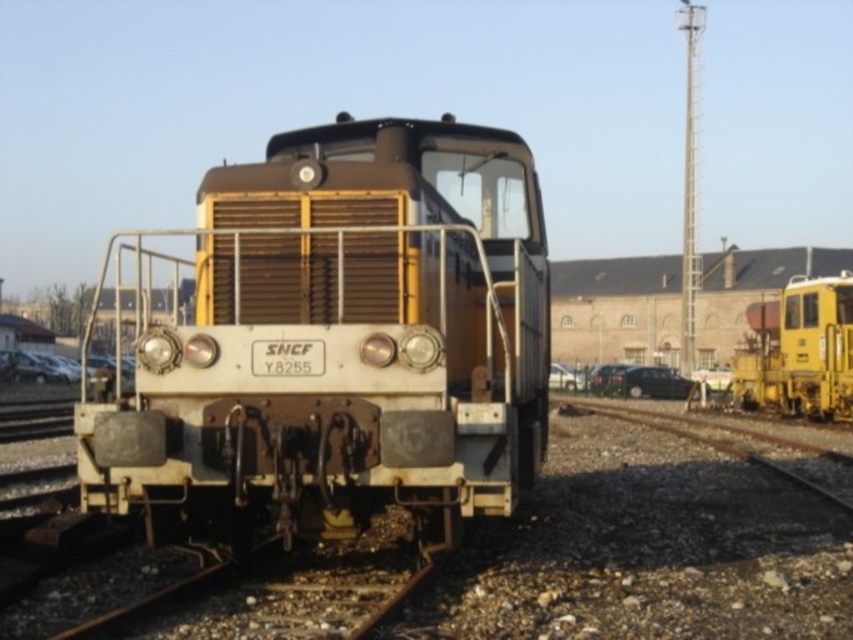
You are a railway engineer observing the diesel locomotive scene. You notice two yellow matte train at center and yellow matte train at right. Which one is closer to you?

The yellow matte train at center is closer to you because it is in front of the yellow matte train at right.

You are a railway inspector checking the spacing between two yellow matte trains. According to safety regulations, the minimum distance between two trains on the same track should be at least 25 meters. Based on the image, are the yellow matte train at center and the yellow matte train at right compliant with this regulation?

The yellow matte train at center and the yellow matte train at right are 26.60 meters apart, which exceeds the minimum required distance of 25 meters. Therefore, they are compliant with the safety regulations.